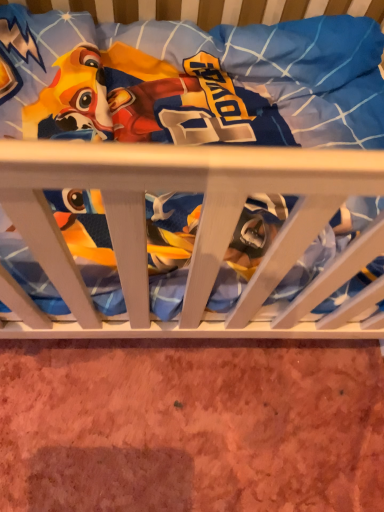
I want to click on white matte crib at center, so click(179, 179).

The image size is (384, 512). What do you see at coordinates (179, 179) in the screenshot?
I see `white matte crib at center` at bounding box center [179, 179].

This screenshot has width=384, height=512. I want to click on white matte crib at center, so click(179, 179).